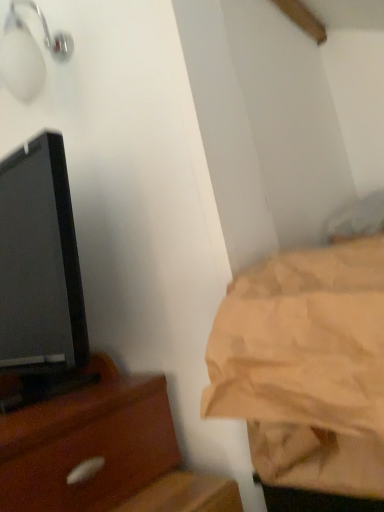
Question: Is white glossy light fixture at upper left oriented away from black glossy tv at left?

Choices:
 (A) no
 (B) yes

Answer: (A)

Question: Is white glossy light fixture at upper left placed right next to black glossy tv at left?

Choices:
 (A) no
 (B) yes

Answer: (A)

Question: From a real-world perspective, is white glossy light fixture at upper left physically above black glossy tv at left?

Choices:
 (A) no
 (B) yes

Answer: (B)

Question: Does white glossy light fixture at upper left have a greater width compared to black glossy tv at left?

Choices:
 (A) yes
 (B) no

Answer: (B)

Question: Is white glossy light fixture at upper left thinner than black glossy tv at left?

Choices:
 (A) no
 (B) yes

Answer: (B)

Question: Considering the relative sizes of white glossy light fixture at upper left and black glossy tv at left in the image provided, is white glossy light fixture at upper left taller than black glossy tv at left?

Choices:
 (A) yes
 (B) no

Answer: (B)

Question: Is black glossy tv at left thinner than beige fabric bedsheet at right?

Choices:
 (A) no
 (B) yes

Answer: (A)

Question: From the image's perspective, is black glossy tv at left beneath beige fabric bedsheet at right?

Choices:
 (A) yes
 (B) no

Answer: (B)

Question: From a real-world perspective, is black glossy tv at left located beneath beige fabric bedsheet at right?

Choices:
 (A) yes
 (B) no

Answer: (B)

Question: Considering the relative positions of black glossy tv at left and beige fabric bedsheet at right in the image provided, is black glossy tv at left to the left of beige fabric bedsheet at right from the viewer's perspective?

Choices:
 (A) yes
 (B) no

Answer: (A)

Question: Is black glossy tv at left wider than beige fabric bedsheet at right?

Choices:
 (A) no
 (B) yes

Answer: (B)

Question: Is black glossy tv at left facing towards beige fabric bedsheet at right?

Choices:
 (A) no
 (B) yes

Answer: (B)

Question: Does white glossy light fixture at upper left turn towards beige fabric bedsheet at right?

Choices:
 (A) no
 (B) yes

Answer: (A)